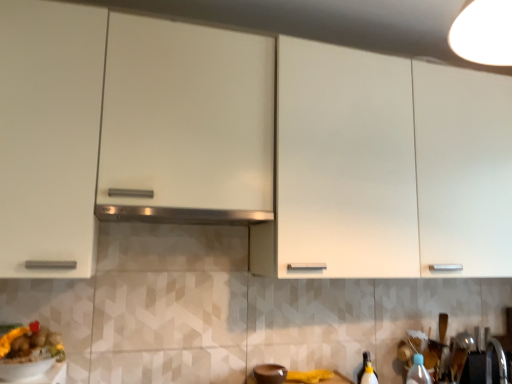
Question: Should I look upward or downward to see satin silver exhaust hood at center?

Choices:
 (A) down
 (B) up

Answer: (A)

Question: Is satin silver exhaust hood at center placed right next to yellow matte food at lower left?

Choices:
 (A) no
 (B) yes

Answer: (A)

Question: Would you say satin silver exhaust hood at center contains yellow matte food at lower left?

Choices:
 (A) no
 (B) yes

Answer: (A)

Question: Is satin silver exhaust hood at center further to camera compared to yellow matte food at lower left?

Choices:
 (A) yes
 (B) no

Answer: (A)

Question: Can you confirm if satin silver exhaust hood at center is taller than yellow matte food at lower left?

Choices:
 (A) yes
 (B) no

Answer: (B)

Question: Considering the relative positions of satin silver exhaust hood at center and yellow matte food at lower left in the image provided, is satin silver exhaust hood at center to the left of yellow matte food at lower left from the viewer's perspective?

Choices:
 (A) no
 (B) yes

Answer: (A)

Question: Is satin silver exhaust hood at center wider than yellow matte food at lower left?

Choices:
 (A) no
 (B) yes

Answer: (B)

Question: From the image's perspective, would you say transparent plastic sink at lower right, the first sink when ordered from left to right, is shown under white glossy cabinet at upper center?

Choices:
 (A) yes
 (B) no

Answer: (A)

Question: Is transparent plastic sink at lower right, the first sink when ordered from left to right, far from white glossy cabinet at upper center?

Choices:
 (A) no
 (B) yes

Answer: (A)

Question: Is transparent plastic sink at lower right, the first sink when ordered from left to right, positioned with its back to white glossy cabinet at upper center?

Choices:
 (A) yes
 (B) no

Answer: (B)

Question: Does transparent plastic sink at lower right, placed as the 2th sink when sorted from right to left, appear on the left side of white glossy cabinet at upper center?

Choices:
 (A) no
 (B) yes

Answer: (A)

Question: Is transparent plastic sink at lower right, placed as the 2th sink when sorted from right to left, next to white glossy cabinet at upper center and touching it?

Choices:
 (A) yes
 (B) no

Answer: (B)

Question: Does transparent plastic sink at lower right, placed as the 2th sink when sorted from right to left, lie behind white glossy cabinet at upper center?

Choices:
 (A) no
 (B) yes

Answer: (B)

Question: From the image's perspective, is yellow matte food at lower left on top of brown matte bowl at lower center?

Choices:
 (A) no
 (B) yes

Answer: (B)